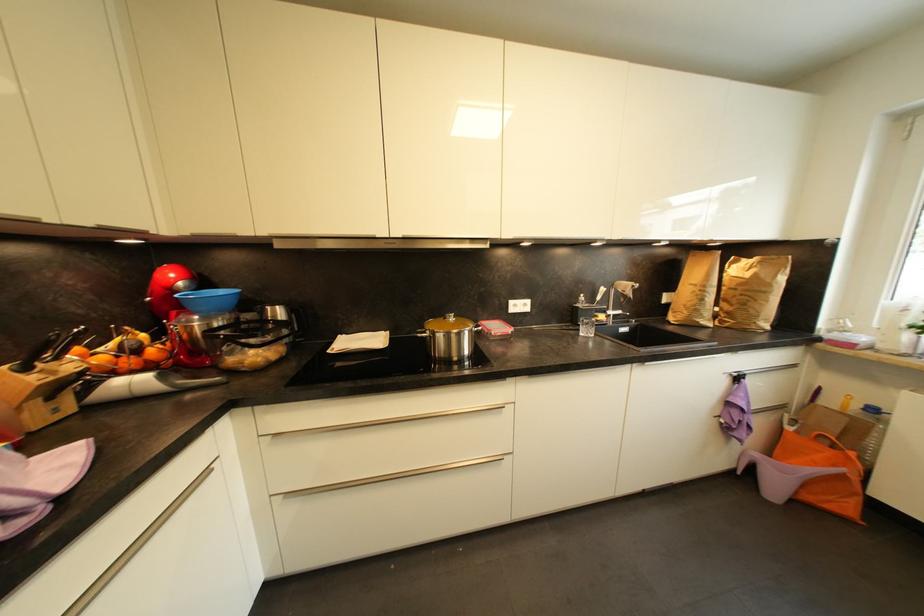
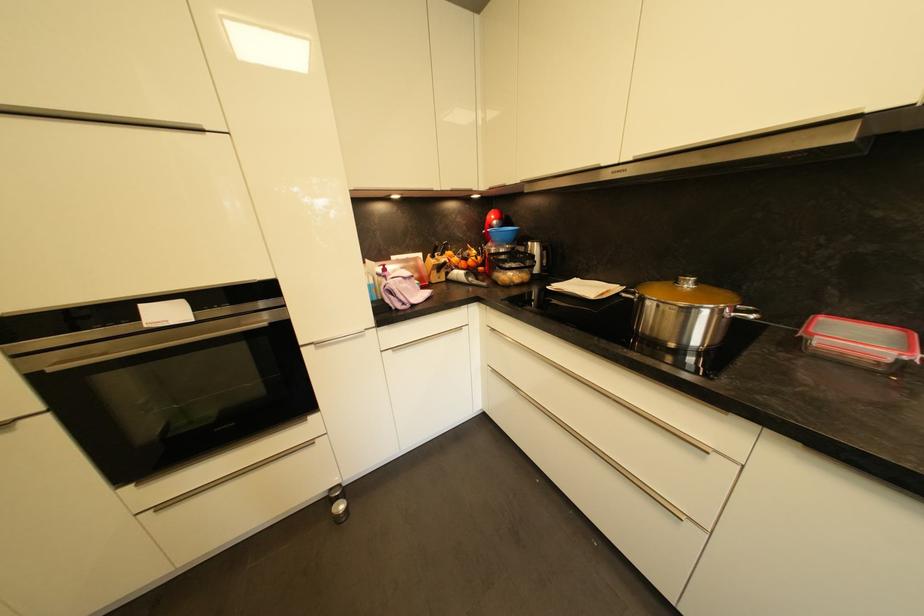
Locate, in the second image, the point that corresponds to point 485,330 in the first image.

(758, 318)